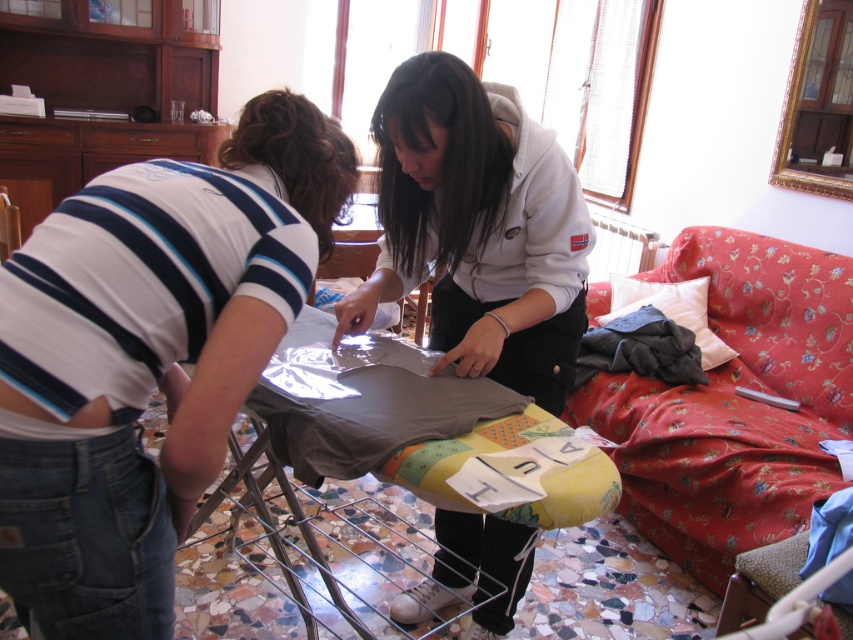
You are a tailor trying to decide where to place a new sewing machine. The machine requires a space taller than the white striped shirt at left. Can the floral fabric couch at right accommodate the sewing machine?

The white striped shirt at left is not as tall as the floral fabric couch at right, so the sewing machine can be placed on the floral fabric couch at right since it is taller than the white striped shirt at left.